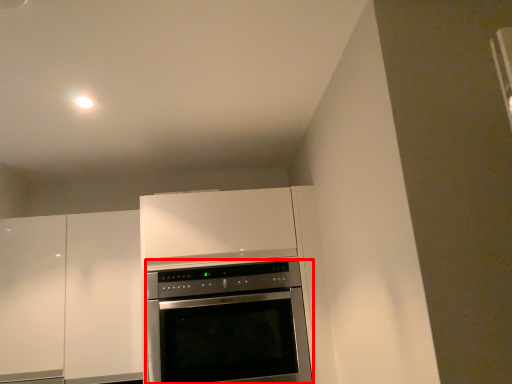
Question: From the image's perspective, where is oven (annotated by the red box) located relative to cabinetry?

Choices:
 (A) above
 (B) below

Answer: (B)